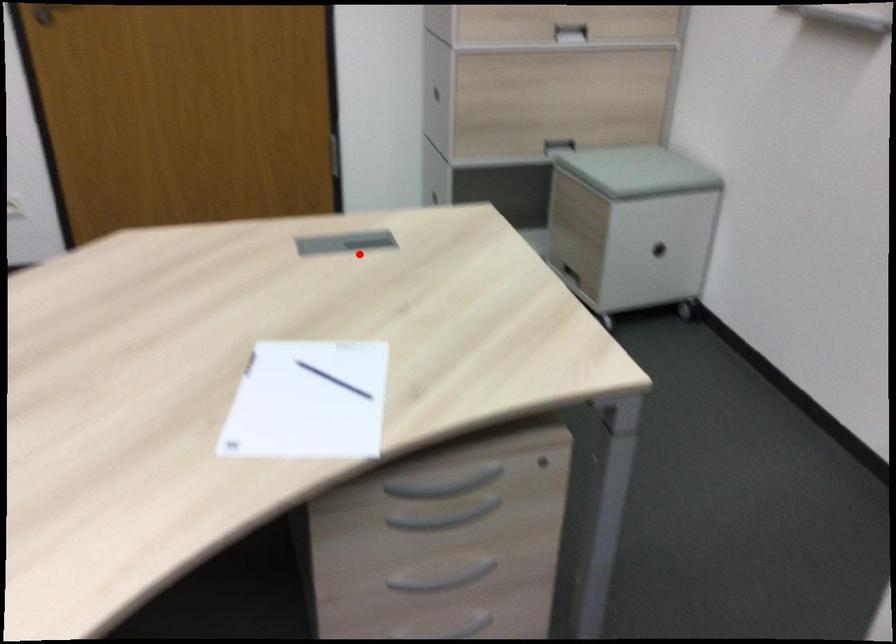
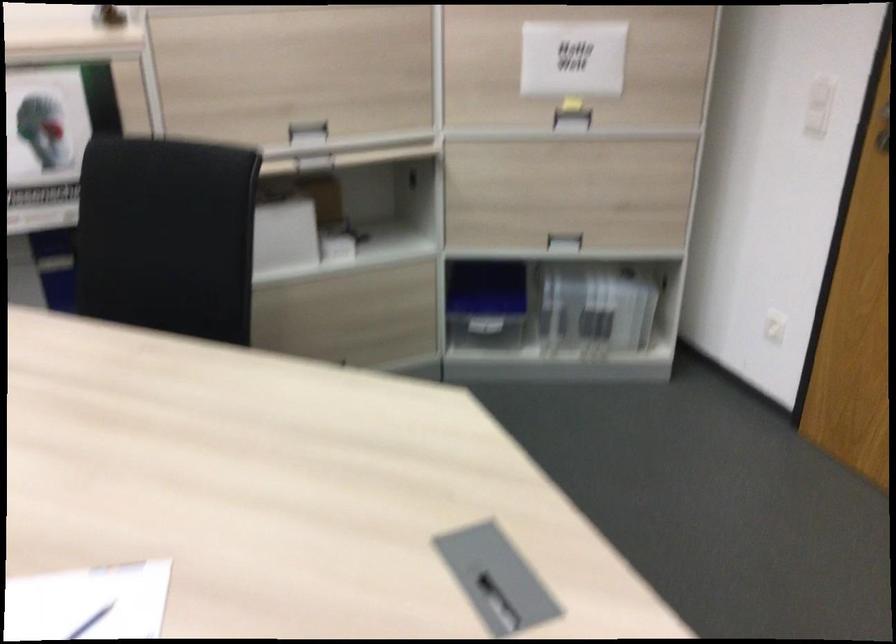
In the second image, find the point that corresponds to the highlighted location in the first image.

(497, 603)